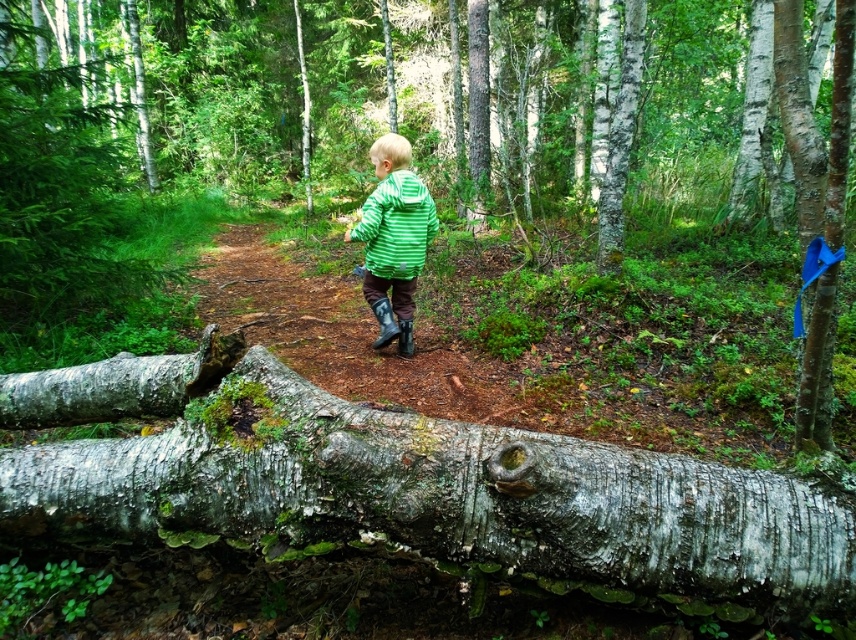
Question: Can you confirm if smooth bark log at lower center is wider than green striped jacket at center?

Choices:
 (A) yes
 (B) no

Answer: (A)

Question: Observing the image, what is the correct spatial positioning of smooth bark log at lower center in reference to smooth gray bark at center?

Choices:
 (A) right
 (B) left

Answer: (A)

Question: Which of the following is the closest to the observer?

Choices:
 (A) click(x=61, y=496)
 (B) click(x=403, y=316)

Answer: (A)

Question: Can you confirm if smooth gray bark at center is positioned below green striped jacket at center?

Choices:
 (A) no
 (B) yes

Answer: (B)

Question: Estimate the real-world distances between objects in this image. Which object is farther from the smooth gray bark at center?

Choices:
 (A) green striped jacket at center
 (B) smooth bark log at lower center

Answer: (B)

Question: Which point is closer to the camera?

Choices:
 (A) green striped jacket at center
 (B) smooth gray bark at center
 (C) smooth bark log at lower center

Answer: (B)